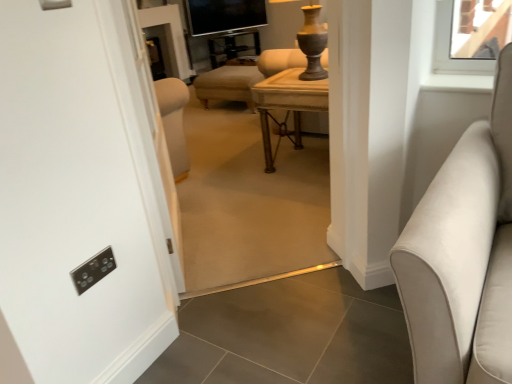
Question: From a real-world perspective, is suede-like beige sofa at right below wooden table at center?

Choices:
 (A) no
 (B) yes

Answer: (A)

Question: Does suede-like beige sofa at right have a larger size compared to wooden table at center?

Choices:
 (A) yes
 (B) no

Answer: (A)

Question: Is suede-like beige sofa at right closer to the viewer compared to wooden table at center?

Choices:
 (A) no
 (B) yes

Answer: (B)

Question: Is suede-like beige sofa at right at the left side of wooden table at center?

Choices:
 (A) no
 (B) yes

Answer: (A)

Question: From a real-world perspective, is suede-like beige sofa at right on top of wooden table at center?

Choices:
 (A) yes
 (B) no

Answer: (A)

Question: In the image, is matte beige ottoman at center positioned in front of or behind wooden table at center?

Choices:
 (A) behind
 (B) front

Answer: (B)

Question: Is point (230, 127) closer or farther from the camera than point (272, 119)?

Choices:
 (A) closer
 (B) farther

Answer: (B)

Question: From the image's perspective, is matte beige ottoman at center located above or below wooden table at center?

Choices:
 (A) above
 (B) below

Answer: (B)

Question: Considering the relative positions of matte beige ottoman at center and wooden table at center in the image provided, is matte beige ottoman at center to the left or to the right of wooden table at center?

Choices:
 (A) right
 (B) left

Answer: (B)

Question: Choose the correct answer: Is black glass tv at upper center inside matte beige ottoman at center or outside it?

Choices:
 (A) inside
 (B) outside

Answer: (B)

Question: Does point (252, 6) appear closer or farther from the camera than point (304, 215)?

Choices:
 (A) closer
 (B) farther

Answer: (B)

Question: Relative to matte beige ottoman at center, is black glass tv at upper center in front or behind?

Choices:
 (A) front
 (B) behind

Answer: (B)

Question: From the image's perspective, relative to matte beige ottoman at center, is black glass tv at upper center above or below?

Choices:
 (A) above
 (B) below

Answer: (A)

Question: From a real-world perspective, is wooden table at center positioned above or below matte beige ottoman at center?

Choices:
 (A) above
 (B) below

Answer: (B)

Question: In terms of height, does wooden table at center look taller or shorter compared to matte beige ottoman at center?

Choices:
 (A) tall
 (B) short

Answer: (B)